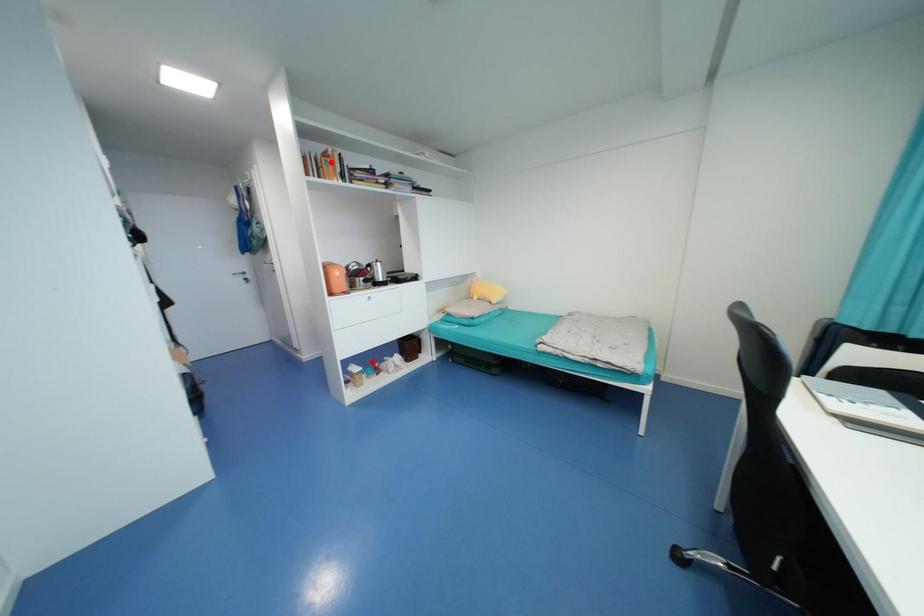
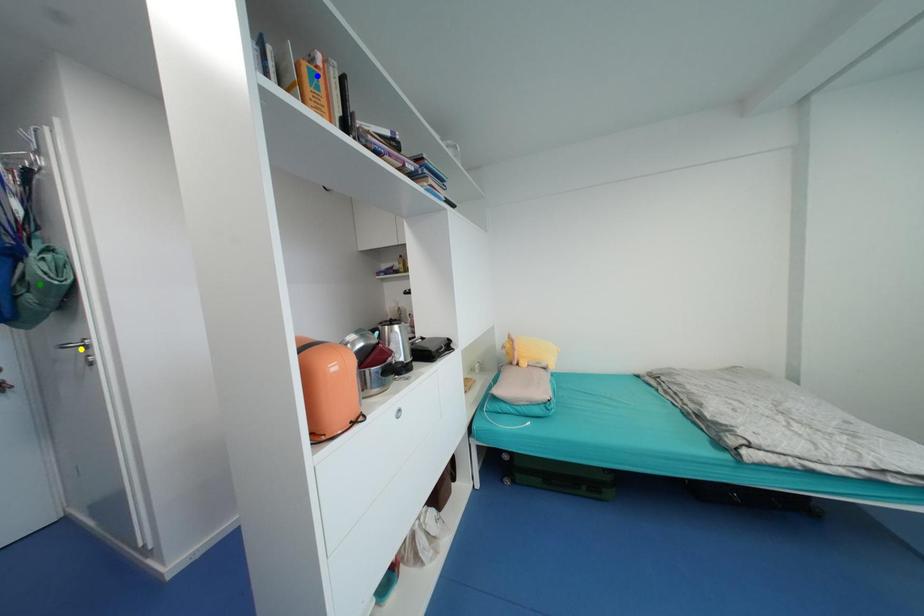
Question: I am providing you with two images of the same scene from different viewpoints. A red point is marked on the first image. You are given multiple points on the second image. Which spot in image 2 lines up with the point in image 1?

Choices:
 (A) green point
 (B) blue point
 (C) yellow point

Answer: (B)